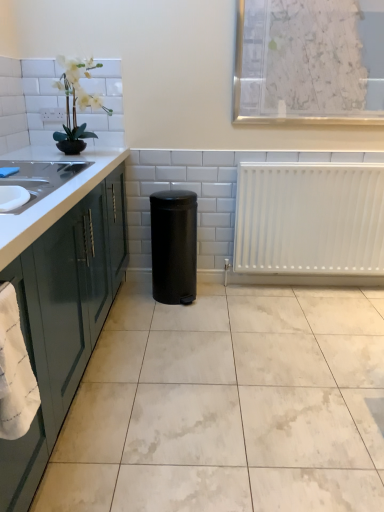
Question: Should I look upward or downward to see white textured paper at upper center?

Choices:
 (A) down
 (B) up

Answer: (B)

Question: Is white marble floor at center located within black matte trash can at center?

Choices:
 (A) yes
 (B) no

Answer: (B)

Question: Can you confirm if black matte trash can at center is bigger than white marble floor at center?

Choices:
 (A) yes
 (B) no

Answer: (B)

Question: Can you confirm if black matte trash can at center is taller than white marble floor at center?

Choices:
 (A) yes
 (B) no

Answer: (A)

Question: Considering the relative positions of black matte trash can at center and white marble floor at center in the image provided, is black matte trash can at center to the left of white marble floor at center from the viewer's perspective?

Choices:
 (A) yes
 (B) no

Answer: (A)

Question: Considering the relative sizes of black matte trash can at center and white marble floor at center in the image provided, is black matte trash can at center shorter than white marble floor at center?

Choices:
 (A) no
 (B) yes

Answer: (A)

Question: Does black matte trash can at center have a greater width compared to white marble floor at center?

Choices:
 (A) no
 (B) yes

Answer: (A)

Question: Does white matte radiator at right have a greater height compared to white marble floor at center?

Choices:
 (A) yes
 (B) no

Answer: (A)

Question: Can you confirm if white matte radiator at right is shorter than white marble floor at center?

Choices:
 (A) yes
 (B) no

Answer: (B)

Question: Does white matte radiator at right have a lesser width compared to white marble floor at center?

Choices:
 (A) yes
 (B) no

Answer: (A)

Question: Considering the relative sizes of white matte radiator at right and white marble floor at center in the image provided, is white matte radiator at right wider than white marble floor at center?

Choices:
 (A) yes
 (B) no

Answer: (B)

Question: Is white marble floor at center a part of white matte radiator at right?

Choices:
 (A) yes
 (B) no

Answer: (B)

Question: Is white matte radiator at right positioned before white marble floor at center?

Choices:
 (A) yes
 (B) no

Answer: (B)

Question: From a real-world perspective, is white marble floor at center beneath white textured paper at upper center?

Choices:
 (A) no
 (B) yes

Answer: (B)